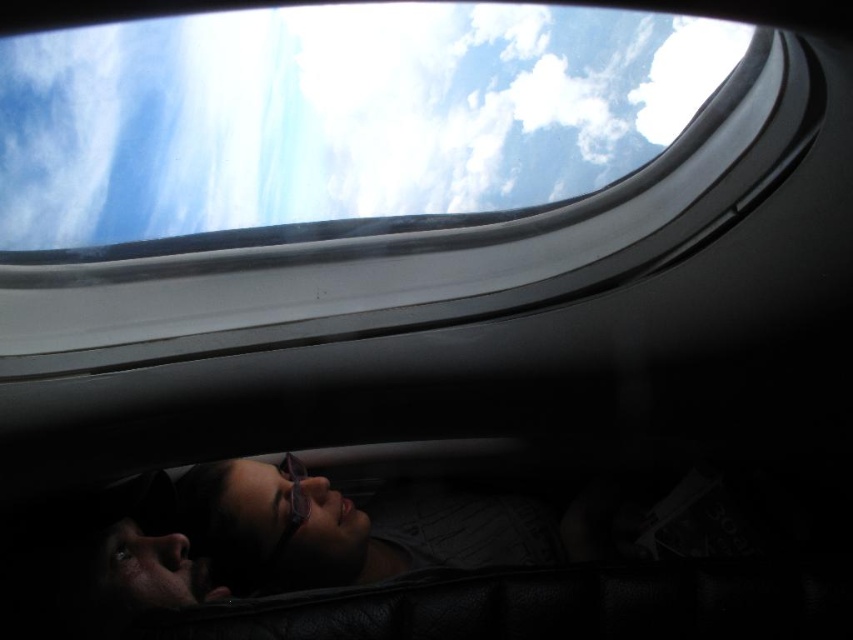
Question: Is white fluffy cloud at upper center positioned at the back of matte black goggles at lower center?

Choices:
 (A) no
 (B) yes

Answer: (A)

Question: Which point is closer to the camera taking this photo?

Choices:
 (A) (263, 196)
 (B) (299, 474)

Answer: (A)

Question: Does white fluffy cloud at upper center appear under matte black goggles at lower center?

Choices:
 (A) yes
 (B) no

Answer: (B)

Question: Can you confirm if white fluffy cloud at upper center is bigger than matte black goggles at lower center?

Choices:
 (A) no
 (B) yes

Answer: (B)

Question: Among these objects, which one is farthest from the camera?

Choices:
 (A) white fluffy cloud at upper center
 (B) matte black goggles at lower center

Answer: (B)